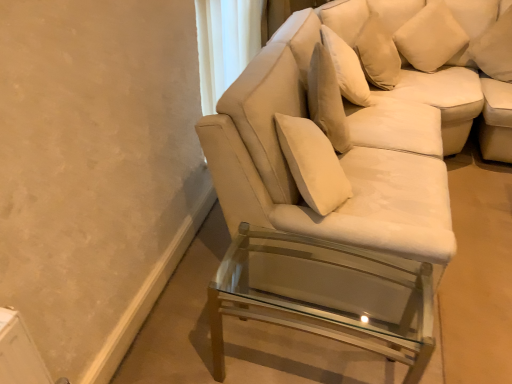
Image resolution: width=512 pixels, height=384 pixels. What do you see at coordinates (495, 48) in the screenshot?
I see `white soft cushion at upper right, arranged as the first pillow when viewed from the right` at bounding box center [495, 48].

Find the location of a particular element. The image size is (512, 384). white soft cushion at upper right, arranged as the first pillow when viewed from the right is located at coordinates (495, 48).

What do you see at coordinates (325, 295) in the screenshot?
I see `clear glass table at lower right` at bounding box center [325, 295].

Identify the location of white fabric couch at center. (326, 191).

Is point (392, 19) less distant than point (396, 32)?

Yes, it is.

From the picture: How many degrees apart are the facing directions of white fabric couch at center and white soft cushion at upper right, which ranks as the first pillow in left-to-right order?

64 degrees.

Relative to white soft cushion at upper right, which ranks as the first pillow in left-to-right order, is white fabric couch at center in front or behind?

Visually, white fabric couch at center is located in front of white soft cushion at upper right, which ranks as the first pillow in left-to-right order.

Considering the sizes of objects white fabric couch at center and white soft cushion at upper right, which ranks as the first pillow in left-to-right order, in the image provided, who is thinner, white fabric couch at center or white soft cushion at upper right, which ranks as the first pillow in left-to-right order,?

Thinner between the two is white soft cushion at upper right, which ranks as the first pillow in left-to-right order.

Considering the relative positions of white soft cushion at upper right, arranged as the first pillow when viewed from the right, and white fabric couch at center in the image provided, is white soft cushion at upper right, arranged as the first pillow when viewed from the right, to the left of white fabric couch at center from the viewer's perspective?

No.

Is white soft cushion at upper right, arranged as the first pillow when viewed from the right, not within white fabric couch at center?

Yes, white soft cushion at upper right, arranged as the first pillow when viewed from the right, is not within white fabric couch at center.

Is point (478, 42) closer or farther from the camera than point (404, 125)?

Point (478, 42) is farther from the camera than point (404, 125).

Looking at this image, is clear glass table at lower right not near white soft cushion at upper right, which ranks as the first pillow in left-to-right order?

Yes.

From the picture: Is clear glass table at lower right closer to the viewer compared to white soft cushion at upper right, which ranks as the first pillow in left-to-right order?

Yes, clear glass table at lower right is closer to the viewer.

Can you confirm if clear glass table at lower right is bigger than white soft cushion at upper right, which ranks as the first pillow in left-to-right order?

Yes, clear glass table at lower right is bigger than white soft cushion at upper right, which ranks as the first pillow in left-to-right order.

From a real-world perspective, is clear glass table at lower right positioned under white soft cushion at upper right, which ranks as the first pillow in left-to-right order, based on gravity?

Yes, from a real-world perspective, clear glass table at lower right is under white soft cushion at upper right, which ranks as the first pillow in left-to-right order.

Could white soft cushion at upper right, the 2th pillow viewed from the left, be considered to be inside white fabric couch at center?

No.

Would you say white fabric couch at center is a long distance from white soft cushion at upper right, arranged as the first pillow when viewed from the right?

Indeed, white fabric couch at center is not near white soft cushion at upper right, arranged as the first pillow when viewed from the right.

Considering the sizes of objects white fabric couch at center and white soft cushion at upper right, the 2th pillow viewed from the left, in the image provided, who is taller, white fabric couch at center or white soft cushion at upper right, the 2th pillow viewed from the left,?

white fabric couch at center is taller.

Which point is more forward, (502, 38) or (272, 283)?

The point (272, 283) is in front.

Considering the sizes of objects white soft cushion at upper right, the 2th pillow viewed from the left, and clear glass table at lower right in the image provided, who is shorter, white soft cushion at upper right, the 2th pillow viewed from the left, or clear glass table at lower right?

Standing shorter between the two is white soft cushion at upper right, the 2th pillow viewed from the left.

Which is correct: white soft cushion at upper right, arranged as the first pillow when viewed from the right, is inside clear glass table at lower right, or outside of it?

white soft cushion at upper right, arranged as the first pillow when viewed from the right, is outside clear glass table at lower right.

From the picture: Does white soft cushion at upper right, arranged as the first pillow when viewed from the right, have a greater width compared to clear glass table at lower right?

Incorrect, the width of white soft cushion at upper right, arranged as the first pillow when viewed from the right, does not surpass that of clear glass table at lower right.

Looking at this image, is white soft cushion at upper right, which ranks as the first pillow in left-to-right order, turned away from white fabric couch at center?

No, white soft cushion at upper right, which ranks as the first pillow in left-to-right order,'s orientation is not away from white fabric couch at center.

Who is taller, white soft cushion at upper right, which ranks as the second pillow in right-to-left order, or white fabric couch at center?

white fabric couch at center.

Considering the positions of objects white soft cushion at upper right, which ranks as the first pillow in left-to-right order, and white fabric couch at center in the image provided, who is more to the left, white soft cushion at upper right, which ranks as the first pillow in left-to-right order, or white fabric couch at center?

From the viewer's perspective, white fabric couch at center appears more on the left side.

From a real-world perspective, is white soft cushion at upper right, which ranks as the second pillow in right-to-left order, under white fabric couch at center?

No.

Are white soft cushion at upper right, the 2th pillow viewed from the left, and white soft cushion at upper right, which ranks as the first pillow in left-to-right order, located far from each other?

No, white soft cushion at upper right, the 2th pillow viewed from the left, is in close proximity to white soft cushion at upper right, which ranks as the first pillow in left-to-right order.

Is white soft cushion at upper right, which ranks as the first pillow in left-to-right order, a part of white soft cushion at upper right, the 2th pillow viewed from the left?

No.

Which of these two, white soft cushion at upper right, arranged as the first pillow when viewed from the right, or white soft cushion at upper right, which ranks as the first pillow in left-to-right order, is thinner?

Thinner between the two is white soft cushion at upper right, which ranks as the first pillow in left-to-right order.

Where is `studio couch below the white soft cushion at upper right, which ranks as the second pillow in right-to-left order (from a real-world perspective)`? Image resolution: width=512 pixels, height=384 pixels. studio couch below the white soft cushion at upper right, which ranks as the second pillow in right-to-left order (from a real-world perspective) is located at coordinates (326, 191).

From a real-world perspective, count 1st pillows upward from the white fabric couch at center and point to it. Please provide its 2D coordinates.

[(495, 48)]

Estimate the real-world distances between objects in this image. Which object is further from white soft cushion at upper right, which ranks as the second pillow in right-to-left order, white fabric couch at center or white soft cushion at upper right, arranged as the first pillow when viewed from the right?

The object further to white soft cushion at upper right, which ranks as the second pillow in right-to-left order, is white fabric couch at center.

Looking at the image, which one is located further to white fabric couch at center, white soft cushion at upper right, arranged as the first pillow when viewed from the right, or clear glass table at lower right?

white soft cushion at upper right, arranged as the first pillow when viewed from the right, is positioned further to the anchor white fabric couch at center.

Based on their spatial positions, is white soft cushion at upper right, which ranks as the second pillow in right-to-left order, or white soft cushion at upper right, the 2th pillow viewed from the left, further from white fabric couch at center?

white soft cushion at upper right, the 2th pillow viewed from the left, lies further to white fabric couch at center than the other object.

Estimate the real-world distances between objects in this image. Which object is further from white fabric couch at center, clear glass table at lower right or white soft cushion at upper right, arranged as the first pillow when viewed from the right?

Based on the image, white soft cushion at upper right, arranged as the first pillow when viewed from the right, appears to be further to white fabric couch at center.

Considering their positions, is white soft cushion at upper right, the 2th pillow viewed from the left, positioned closer to white fabric couch at center than white soft cushion at upper right, which ranks as the first pillow in left-to-right order?

white soft cushion at upper right, which ranks as the first pillow in left-to-right order, lies closer to white fabric couch at center than the other object.

Considering their positions, is white soft cushion at upper right, which ranks as the second pillow in right-to-left order, positioned further to white soft cushion at upper right, the 2th pillow viewed from the left, than white fabric couch at center?

Among the two, white fabric couch at center is located further to white soft cushion at upper right, the 2th pillow viewed from the left.

From the image, which object appears to be nearer to clear glass table at lower right, white soft cushion at upper right, the 2th pillow viewed from the left, or white soft cushion at upper right, which ranks as the first pillow in left-to-right order?

white soft cushion at upper right, which ranks as the first pillow in left-to-right order, lies closer to clear glass table at lower right than the other object.

Estimate the real-world distances between objects in this image. Which object is further from white soft cushion at upper right, the 2th pillow viewed from the left, clear glass table at lower right or white fabric couch at center?

The object further to white soft cushion at upper right, the 2th pillow viewed from the left, is clear glass table at lower right.

Locate an element on the screen. pillow between white soft cushion at upper right, which ranks as the second pillow in right-to-left order, and clear glass table at lower right, in the vertical direction is located at coordinates 495,48.

I want to click on studio couch between clear glass table at lower right and white soft cushion at upper right, which ranks as the second pillow in right-to-left order, in the front-back direction, so click(326, 191).

The height and width of the screenshot is (384, 512). I want to click on pillow between white fabric couch at center and white soft cushion at upper right, which ranks as the first pillow in left-to-right order, from front to back, so click(x=495, y=48).

Image resolution: width=512 pixels, height=384 pixels. What are the coordinates of `studio couch between clear glass table at lower right and white soft cushion at upper right, the 2th pillow viewed from the left, from left to right` in the screenshot? It's located at (x=326, y=191).